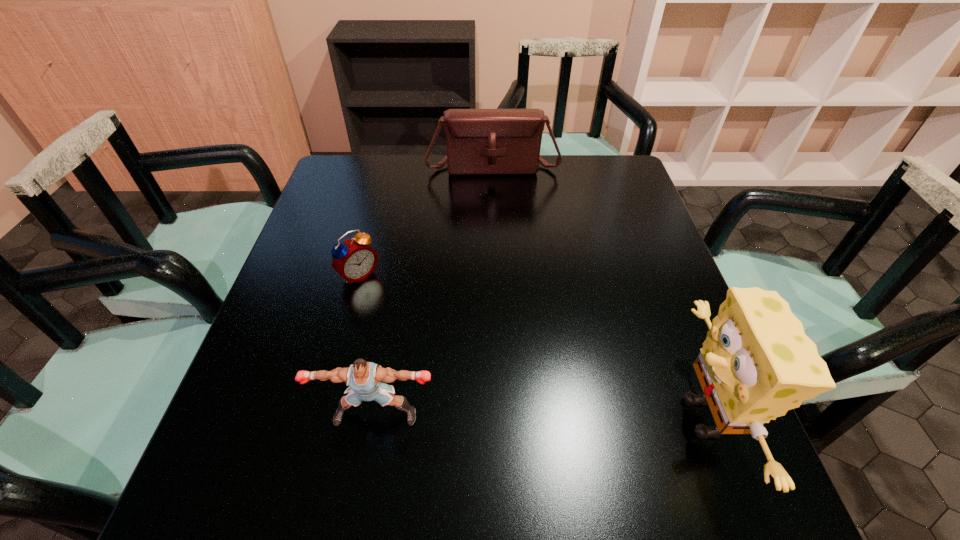
Locate an element on the screen. vacant space located on the front-facing side of the second farthest object is located at coordinates (444, 360).

Locate an element on the screen. free space located on the front-facing side of the second farthest object is located at coordinates (409, 325).

The height and width of the screenshot is (540, 960). Identify the location of blank area located 0.270m on the front flap of the farthest object. (502, 237).

In order to click on vacant region located on the front flap of the farthest object in this screenshot , I will do `click(501, 225)`.

At what (x,y) coordinates should I click in order to perform the action: click on vacant region located 0.360m on the front flap of the farthest object. Please return your answer as a coordinate pair (x, y). This screenshot has width=960, height=540. Looking at the image, I should click on (505, 260).

Find the location of `object at the far edge`. object at the far edge is located at coordinates (479, 141).

Identify the location of puncher located in the near edge section of the desktop. (364, 378).

Find the location of a particular element. The image size is (960, 540). sponge located at the near edge is located at coordinates (756, 363).

Locate an element on the screen. The image size is (960, 540). puncher positioned at the left edge is located at coordinates (364, 378).

Locate an element on the screen. This screenshot has width=960, height=540. alarm clock at the left edge is located at coordinates (354, 260).